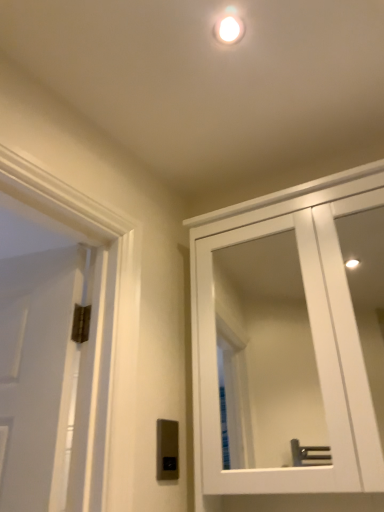
Question: Does white glossy droplight at upper center come in front of white glossy cabinet at upper right?

Choices:
 (A) yes
 (B) no

Answer: (B)

Question: Is white glossy droplight at upper center further to the viewer compared to white glossy cabinet at upper right?

Choices:
 (A) yes
 (B) no

Answer: (A)

Question: From a real-world perspective, is white glossy droplight at upper center located higher than white glossy cabinet at upper right?

Choices:
 (A) yes
 (B) no

Answer: (A)

Question: Does white glossy droplight at upper center have a greater height compared to white glossy cabinet at upper right?

Choices:
 (A) no
 (B) yes

Answer: (A)

Question: Is white glossy droplight at upper center bigger than white glossy cabinet at upper right?

Choices:
 (A) yes
 (B) no

Answer: (B)

Question: From a real-world perspective, is white glossy droplight at upper center below white glossy cabinet at upper right?

Choices:
 (A) no
 (B) yes

Answer: (A)

Question: Does white glossy cabinet at upper right have a lesser height compared to white glossy droplight at upper center?

Choices:
 (A) no
 (B) yes

Answer: (A)

Question: From a real-world perspective, does white glossy cabinet at upper right stand above white glossy droplight at upper center?

Choices:
 (A) yes
 (B) no

Answer: (B)

Question: Is white glossy cabinet at upper right positioned in front of white glossy droplight at upper center?

Choices:
 (A) yes
 (B) no

Answer: (A)

Question: Is white glossy cabinet at upper right bigger than white glossy droplight at upper center?

Choices:
 (A) yes
 (B) no

Answer: (A)

Question: From the image's perspective, is white glossy cabinet at upper right above white glossy droplight at upper center?

Choices:
 (A) yes
 (B) no

Answer: (B)

Question: Is white glossy cabinet at upper right oriented towards white glossy droplight at upper center?

Choices:
 (A) no
 (B) yes

Answer: (A)

Question: From a real-world perspective, is satin silver switch at lower center located beneath white glossy droplight at upper center?

Choices:
 (A) yes
 (B) no

Answer: (A)